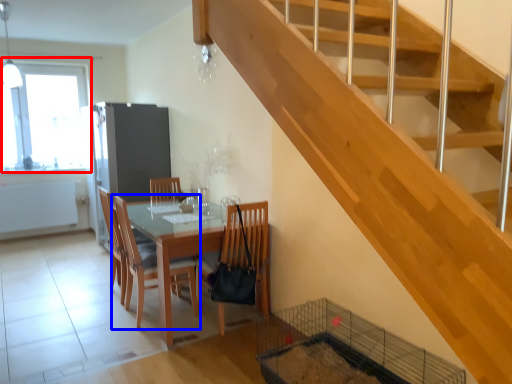
Question: Among these objects, which one is nearest to the camera, window (highlighted by a red box) or chair (highlighted by a blue box)?

Choices:
 (A) window
 (B) chair

Answer: (B)